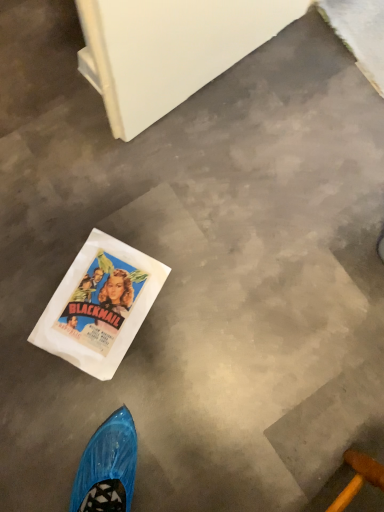
Locate an element on the screen. free space above white paper comic book at lower left (from a real-world perspective) is located at coordinates (75, 318).